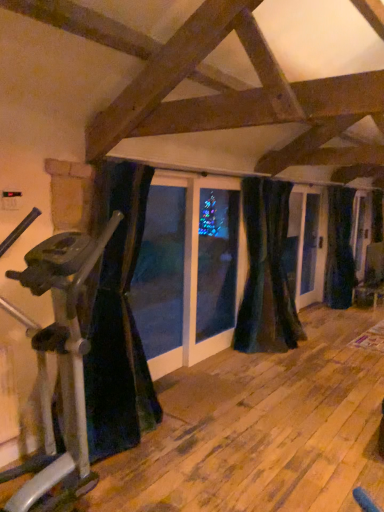
Find the location of a particular element. This screenshot has width=384, height=512. free point to the right of velvet dark blue curtain at center, marked as the 2th curtain in a front-to-back arrangement is located at coordinates (316, 353).